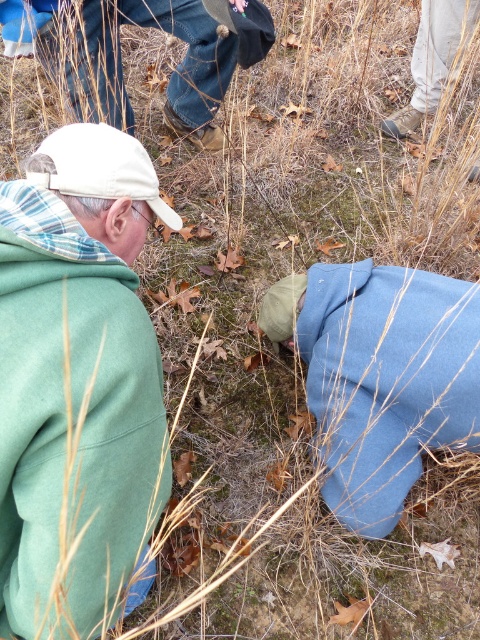
Question: Which object is farther from the camera taking this photo?

Choices:
 (A) brown leather boots at upper center
 (B) green fleece jacket at left
 (C) blue fleece jacket at lower right

Answer: (A)

Question: Can you confirm if blue fleece jacket at lower right is positioned to the left of brown leather boots at upper center?

Choices:
 (A) yes
 (B) no

Answer: (B)

Question: Considering the real-world distances, which object is farthest from the brown leather boots at upper center?

Choices:
 (A) blue fleece jacket at lower right
 (B) green fleece jacket at left

Answer: (B)

Question: Can you confirm if green fleece jacket at left is positioned to the left of brown leather boots at upper center?

Choices:
 (A) yes
 (B) no

Answer: (B)

Question: Is green fleece jacket at left behind brown leather boots at upper center?

Choices:
 (A) yes
 (B) no

Answer: (B)

Question: Based on their relative distances, which object is nearer to the blue fleece jacket at lower right?

Choices:
 (A) green fleece jacket at left
 (B) brown leather boots at upper center

Answer: (A)